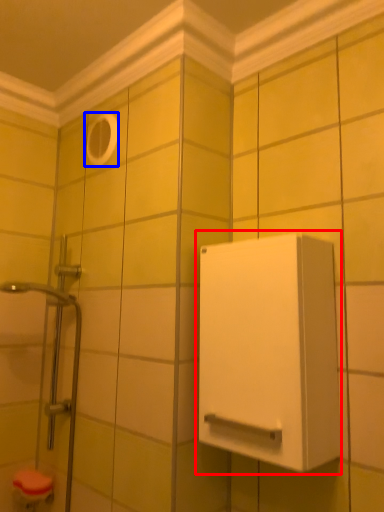
Question: Which object appears closest to the camera in this image, medicine cabinet (highlighted by a red box) or hole (highlighted by a blue box)?

Choices:
 (A) medicine cabinet
 (B) hole

Answer: (A)